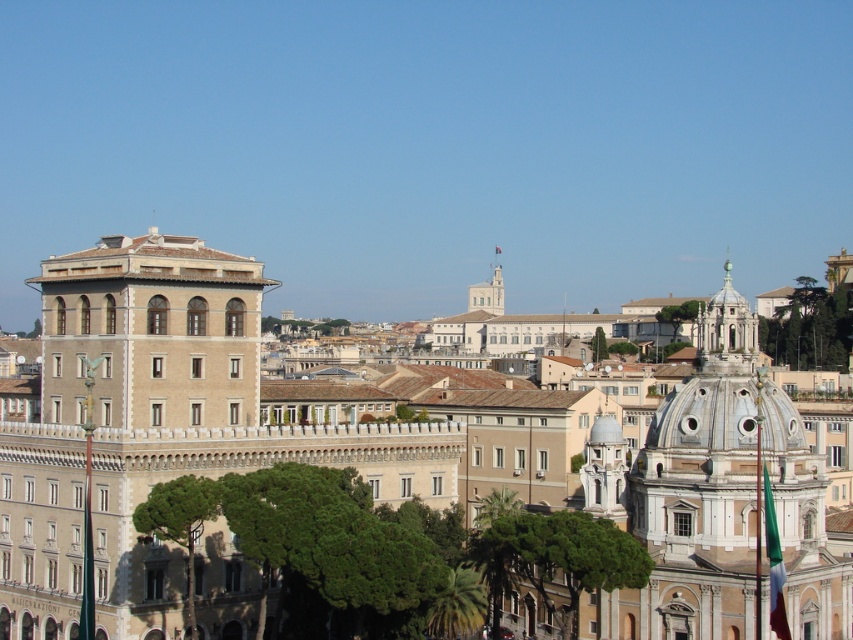
Does point (540, 406) lie behind point (786, 522)?

Yes, point (540, 406) is behind point (786, 522).

Can you confirm if beige stone building at center is positioned above white marble dome at upper right?

Actually, beige stone building at center is below white marble dome at upper right.

Where is `beige stone building at center`? The height and width of the screenshot is (640, 853). beige stone building at center is located at coordinates (189, 433).